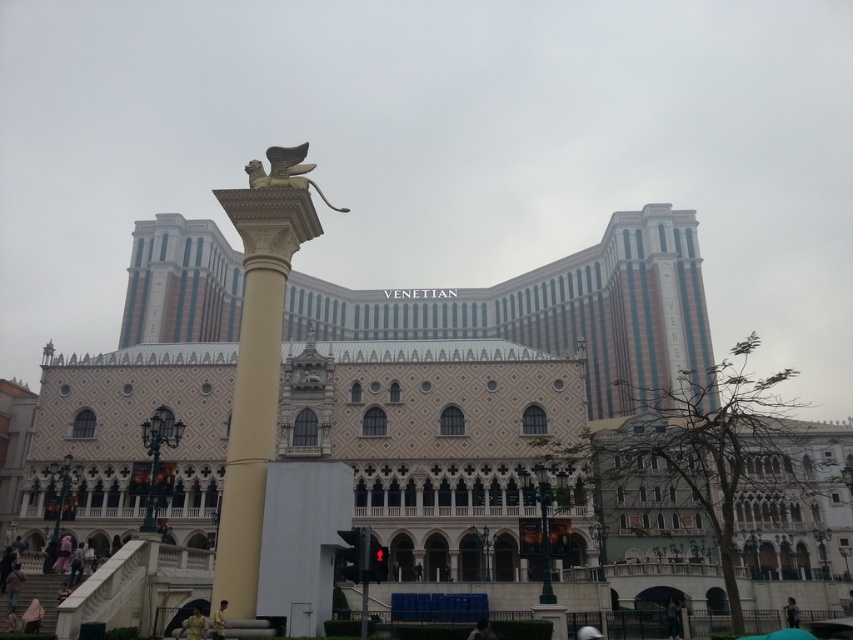
Question: Can you confirm if yellow matte shirt at lower center is bigger than dark gray fabric jacket at lower right?

Choices:
 (A) no
 (B) yes

Answer: (A)

Question: Is light brown leather jacket at lower center to the left of dark blue fabric at lower center from the viewer's perspective?

Choices:
 (A) yes
 (B) no

Answer: (A)

Question: From the image, what is the correct spatial relationship of gold polished column at center in relation to light brown leather jacket at lower center?

Choices:
 (A) left
 (B) right

Answer: (A)

Question: Estimate the real-world distances between objects in this image. Which object is farther from the dark gray fabric jacket at lower right?

Choices:
 (A) yellow matte shirt at lower center
 (B) gold polished stone lion at center
 (C) light brown leather jacket at lower center

Answer: (B)

Question: Which is nearer to the yellow matte shirt at lower center?

Choices:
 (A) dark blue fabric at lower center
 (B) gold polished stone lion at center

Answer: (A)

Question: Which point appears closest to the camera in this image?

Choices:
 (A) (218, 609)
 (B) (282, 259)

Answer: (A)